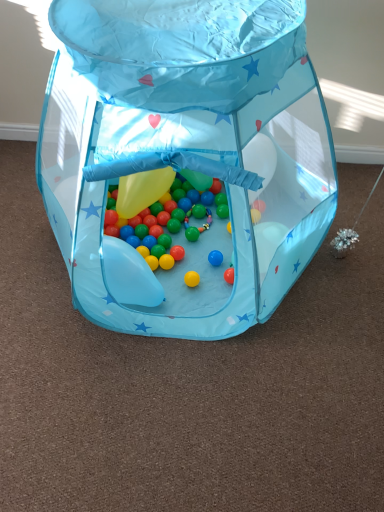
Question: From the image's perspective, is shiny metallic ball at center located above translucent plastic balloon at lower left?

Choices:
 (A) no
 (B) yes

Answer: (B)

Question: Is shiny metallic ball at center facing away from translucent plastic balloon at lower left?

Choices:
 (A) yes
 (B) no

Answer: (B)

Question: Does shiny metallic ball at center have a greater width compared to translucent plastic balloon at lower left?

Choices:
 (A) no
 (B) yes

Answer: (B)

Question: Could you tell me if shiny metallic ball at center is turned towards translucent plastic balloon at lower left?

Choices:
 (A) yes
 (B) no

Answer: (A)

Question: Would you consider shiny metallic ball at center to be distant from translucent plastic balloon at lower left?

Choices:
 (A) no
 (B) yes

Answer: (A)

Question: In terms of width, does shiny metallic ball at center look wider or thinner when compared to shiny plastic beads at center?

Choices:
 (A) thin
 (B) wide

Answer: (B)

Question: Visually, is shiny metallic ball at center positioned to the left or to the right of shiny plastic beads at center?

Choices:
 (A) left
 (B) right

Answer: (A)

Question: From a real-world perspective, relative to shiny plastic beads at center, is shiny metallic ball at center vertically above or below?

Choices:
 (A) below
 (B) above

Answer: (B)

Question: Do you think shiny metallic ball at center is within shiny plastic beads at center, or outside of it?

Choices:
 (A) outside
 (B) inside

Answer: (A)

Question: Is shiny metallic ball at center wider or thinner than translucent plastic balloon at lower left?

Choices:
 (A) wide
 (B) thin

Answer: (A)

Question: Is shiny metallic ball at center to the left or to the right of translucent plastic balloon at lower left in the image?

Choices:
 (A) right
 (B) left

Answer: (A)

Question: Considering their positions, is shiny metallic ball at center located in front of or behind translucent plastic balloon at lower left?

Choices:
 (A) behind
 (B) front

Answer: (B)

Question: Considering the positions of point (254, 16) and point (144, 271), is point (254, 16) closer or farther from the camera than point (144, 271)?

Choices:
 (A) farther
 (B) closer

Answer: (B)

Question: Do you think translucent plastic balloon at lower left is within shiny plastic beads at center, or outside of it?

Choices:
 (A) inside
 (B) outside

Answer: (B)

Question: In the image, is translucent plastic balloon at lower left on the left side or the right side of shiny plastic beads at center?

Choices:
 (A) right
 (B) left

Answer: (B)